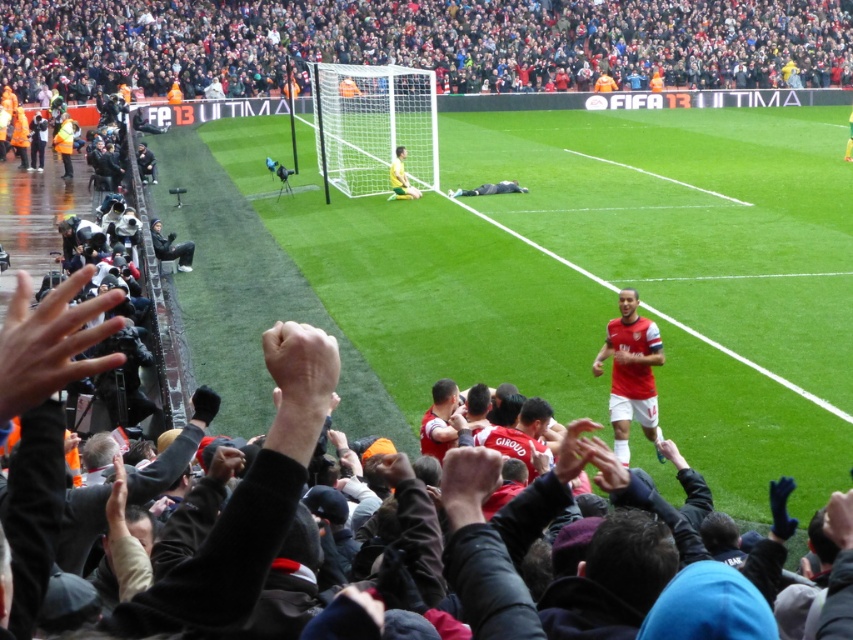
In the scene shown: You are a soccer player positioned at point (445, 419). You want to pass the ball to your teammate who is at point (724, 292). Is your teammate behind you or in front of you?

Point (724, 292) is behind point (445, 419), so your teammate is behind you.

You are a photographer trying to capture a photo of the soccer stadium. Which area takes up more space in the image, the green grass football field at center or the red fabric crowd at upper center?

The red fabric crowd at upper center occupies more space in the image than the green grass football field at center.

Based on the photo, you are a drone operator trying to capture aerial footage of the soccer match. The camera is currently positioned above the point marked at coordinates (689, 218). What will the camera primarily see in this position?

The camera positioned above the point marked at coordinates (689, 218) will primarily see the green grass football field at center, as the coordinates indicate that location.